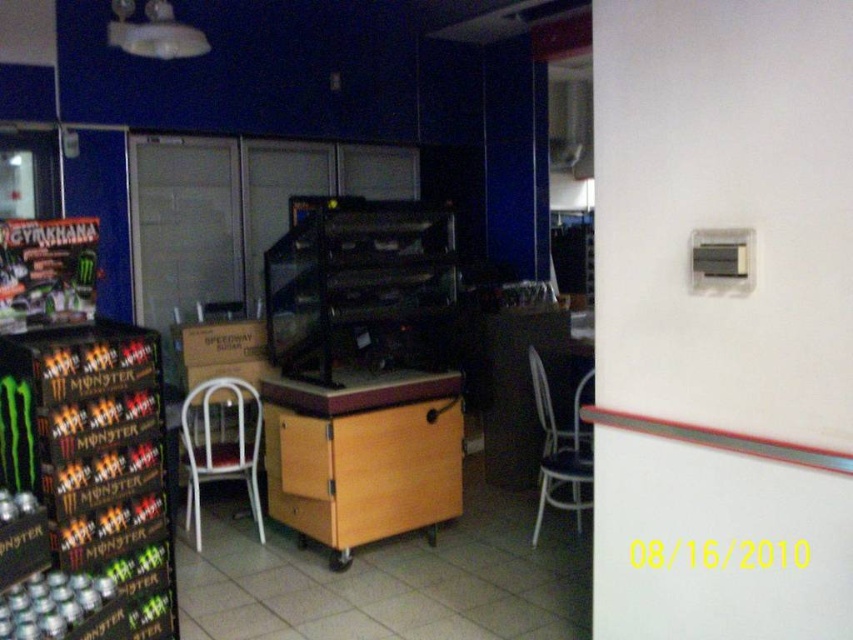
Question: Where is wooden table at center located in relation to white metal chair at left in the image?

Choices:
 (A) left
 (B) right

Answer: (B)

Question: Is wooden table at center wider than white metal chair at left?

Choices:
 (A) no
 (B) yes

Answer: (B)

Question: Among these objects, which one is nearest to the camera?

Choices:
 (A) white metal chair at left
 (B) white metal chair at center
 (C) wooden table at center

Answer: (C)

Question: Which point is farther from the camera taking this photo?

Choices:
 (A) (299, 456)
 (B) (225, 440)
 (C) (552, 422)

Answer: (B)

Question: Does white metal chair at left appear on the left side of white metal chair at center?

Choices:
 (A) no
 (B) yes

Answer: (B)

Question: Which object appears closest to the camera in this image?

Choices:
 (A) white metal chair at center
 (B) white metal chair at left
 (C) wooden table at center

Answer: (C)